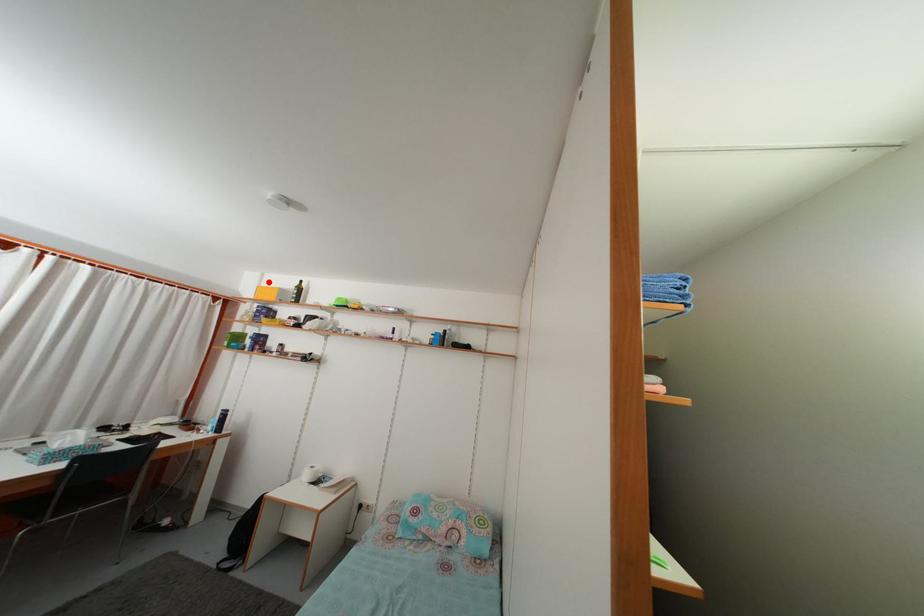
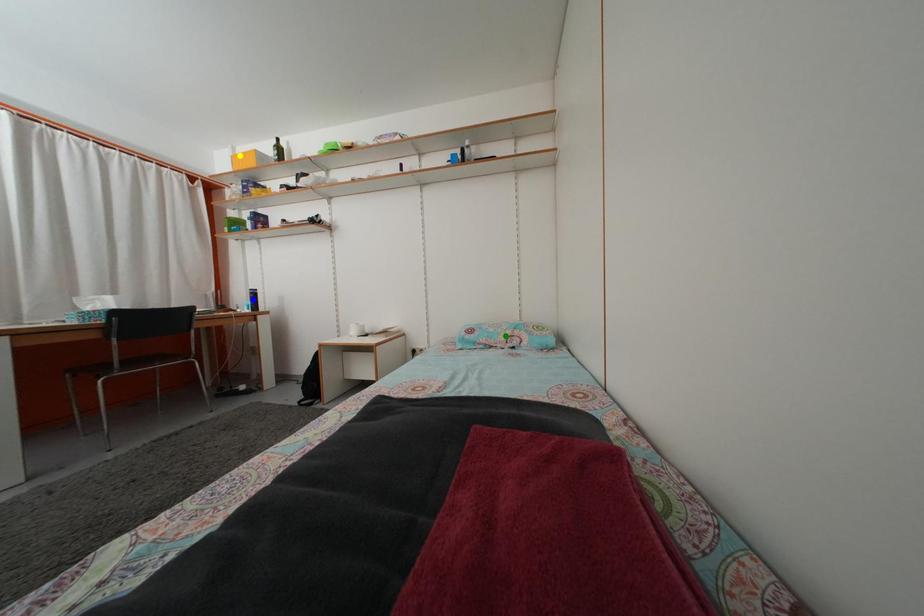
Question: I am providing you with two images of the same scene from different viewpoints. A red point is marked on the first image. You are given multiple points on the second image. Which spot in image 2 lines up with the point in image 1?

Choices:
 (A) green point
 (B) yellow point
 (C) blue point

Answer: (B)